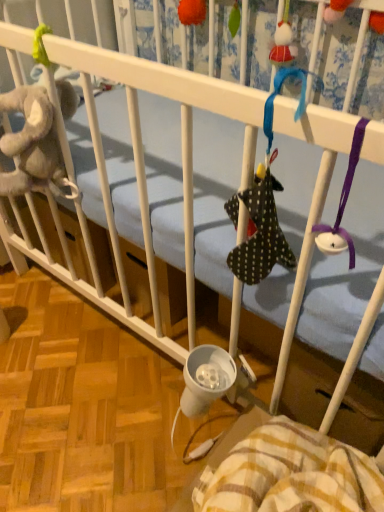
Question: From a real-world perspective, is yellow plaid blanket at lower right physically above orange fuzzy ball at upper center, marked as the second toy in a right-to-left arrangement?

Choices:
 (A) yes
 (B) no

Answer: (B)

Question: From a real-world perspective, is yellow plaid blanket at lower right below orange fuzzy ball at upper center, which is counted as the 1th toy, starting from the top?

Choices:
 (A) no
 (B) yes

Answer: (B)

Question: Can you confirm if yellow plaid blanket at lower right is positioned to the right of orange fuzzy ball at upper center, which is counted as the 1th toy, starting from the top?

Choices:
 (A) yes
 (B) no

Answer: (A)

Question: Is yellow plaid blanket at lower right oriented away from orange fuzzy ball at upper center, the 2th toy when ordered from front to back?

Choices:
 (A) no
 (B) yes

Answer: (A)

Question: Is yellow plaid blanket at lower right not inside orange fuzzy ball at upper center, which is counted as the 1th toy, starting from the top?

Choices:
 (A) yes
 (B) no

Answer: (A)

Question: Is yellow plaid blanket at lower right in front of or behind orange fuzzy ball at upper center, the first toy from the back, in the image?

Choices:
 (A) behind
 (B) front

Answer: (B)

Question: Is yellow plaid blanket at lower right bigger or smaller than orange fuzzy ball at upper center, the first toy positioned from the left?

Choices:
 (A) small
 (B) big

Answer: (B)

Question: From the image's perspective, is yellow plaid blanket at lower right located above or below orange fuzzy ball at upper center, marked as the second toy in a right-to-left arrangement?

Choices:
 (A) above
 (B) below

Answer: (B)

Question: Is yellow plaid blanket at lower right wider or thinner than orange fuzzy ball at upper center, the first toy positioned from the left?

Choices:
 (A) wide
 (B) thin

Answer: (A)

Question: In the image, is polka dot fabric sock at upper center, which ranks as the 2th toy in back-to-front order, on the left side or the right side of orange fuzzy ball at upper center, marked as the second toy in a right-to-left arrangement?

Choices:
 (A) left
 (B) right

Answer: (B)

Question: From a real-world perspective, relative to orange fuzzy ball at upper center, the first toy positioned from the left, is polka dot fabric sock at upper center, which ranks as the 2th toy in back-to-front order, vertically above or below?

Choices:
 (A) below
 (B) above

Answer: (A)

Question: In the image, is polka dot fabric sock at upper center, the first toy ordered from the bottom, positioned in front of or behind orange fuzzy ball at upper center, the 2th toy when ordered from front to back?

Choices:
 (A) front
 (B) behind

Answer: (A)

Question: Looking at their shapes, would you say polka dot fabric sock at upper center, which ranks as the 2th toy in back-to-front order, is wider or thinner than orange fuzzy ball at upper center, the 2th toy when ordered from front to back?

Choices:
 (A) thin
 (B) wide

Answer: (B)

Question: Considering their positions, is orange fuzzy ball at upper center, placed as the second toy when sorted from bottom to top, located in front of or behind yellow plaid blanket at lower right?

Choices:
 (A) front
 (B) behind

Answer: (B)

Question: From the image's perspective, relative to yellow plaid blanket at lower right, is orange fuzzy ball at upper center, marked as the second toy in a right-to-left arrangement, above or below?

Choices:
 (A) below
 (B) above

Answer: (B)